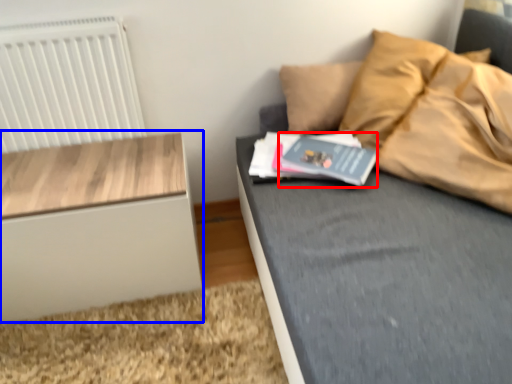
Question: Which object is further to the camera taking this photo, paperback book (highlighted by a red box) or nightstand (highlighted by a blue box)?

Choices:
 (A) paperback book
 (B) nightstand

Answer: (A)